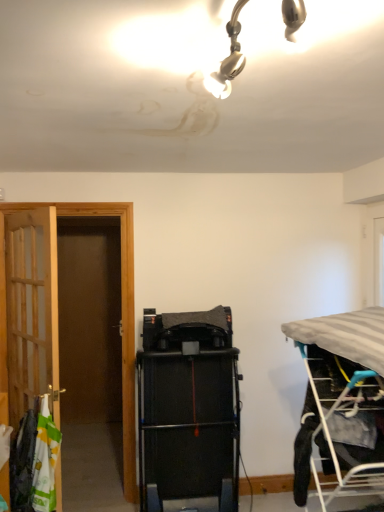
What do you see at coordinates (341, 404) in the screenshot? I see `gray fabric bed at right` at bounding box center [341, 404].

Identify the location of wooden door at left. (31, 310).

This screenshot has height=512, width=384. I want to click on white fabric laundry at left, so click(x=34, y=462).

Is black rubber treadmill at center next to white fabric laundry at left?

black rubber treadmill at center and white fabric laundry at left are clearly separated.

Is black rubber treadmill at center taller or shorter than white fabric laundry at left?

Clearly, black rubber treadmill at center is taller compared to white fabric laundry at left.

Considering the points (225, 337) and (22, 443), which point is in front, point (225, 337) or point (22, 443)?

The point (22, 443) is more forward.

Which of these two, black rubber treadmill at center or white fabric laundry at left, is smaller?

white fabric laundry at left is smaller.

Is there a large distance between white fabric laundry at left and wooden door at left?

No.

From a real-world perspective, does white fabric laundry at left sit lower than wooden door at left?

Yes, from a real-world perspective, white fabric laundry at left is beneath wooden door at left.

Considering the relative sizes of white fabric laundry at left and wooden door at left in the image provided, is white fabric laundry at left shorter than wooden door at left?

Indeed, white fabric laundry at left has a lesser height compared to wooden door at left.

What's the angular difference between black rubber treadmill at center and gray fabric bed at right's facing directions?

The facing directions of black rubber treadmill at center and gray fabric bed at right are 88.3 degrees apart.

Based on the photo, does black rubber treadmill at center come behind gray fabric bed at right?

Yes, black rubber treadmill at center is further from the camera.

I want to click on bed above the black rubber treadmill at center (from the image's perspective), so click(341, 404).

Based on their sizes in the image, would you say black rubber treadmill at center is bigger or smaller than gray fabric bed at right?

Clearly, black rubber treadmill at center is larger in size than gray fabric bed at right.

Who is shorter, gray fabric bed at right or white fabric laundry at left?

With less height is white fabric laundry at left.

From the picture: Can we say gray fabric bed at right lies outside white fabric laundry at left?

Indeed, gray fabric bed at right is completely outside white fabric laundry at left.

Does gray fabric bed at right appear on the right side of white fabric laundry at left?

Yes.

Considering the sizes of gray fabric bed at right and white fabric laundry at left in the image, is gray fabric bed at right bigger or smaller than white fabric laundry at left?

Clearly, gray fabric bed at right is larger in size than white fabric laundry at left.

Consider the image. From a real-world perspective, does wooden door at left sit lower than white fabric laundry at left?

No.

Is wooden door at left not inside white fabric laundry at left?

Yes, wooden door at left is located beyond the bounds of white fabric laundry at left.

Consider the image. Considering the sizes of objects wooden door at left and white fabric laundry at left in the image provided, who is taller, wooden door at left or white fabric laundry at left?

With more height is wooden door at left.

The width and height of the screenshot is (384, 512). What are the coordinates of `laundry on the right of the wooden door at left` in the screenshot? It's located at (34, 462).

Can you tell me how much gray fabric bed at right and wooden door at left differ in facing direction?

gray fabric bed at right and wooden door at left are facing 145 degrees away from each other.

Visually, is gray fabric bed at right positioned to the left or to the right of wooden door at left?

Clearly, gray fabric bed at right is on the right of wooden door at left in the image.

Are gray fabric bed at right and wooden door at left beside each other?

gray fabric bed at right is not next to wooden door at left, and they're not touching.

Based on the photo, based on their positions, is wooden door at left located to the left or right of black rubber treadmill at center?

Clearly, wooden door at left is on the left of black rubber treadmill at center in the image.

Who is taller, wooden door at left or black rubber treadmill at center?

Standing taller between the two is wooden door at left.

Is there a large distance between wooden door at left and black rubber treadmill at center?

No, wooden door at left is in close proximity to black rubber treadmill at center.

From the picture: How far apart are wooden door at left and black rubber treadmill at center?

31.05 inches.

Image resolution: width=384 pixels, height=512 pixels. What are the coordinates of `laundry below the black rubber treadmill at center (from a real-world perspective)` in the screenshot? It's located at (34, 462).

Find the location of a particular element. The height and width of the screenshot is (512, 384). door behind the white fabric laundry at left is located at coordinates (31, 310).

Looking at the image, which one is located further to black rubber treadmill at center, gray fabric bed at right or white fabric laundry at left?

gray fabric bed at right is positioned further to the anchor black rubber treadmill at center.

Which object lies further to the anchor point wooden door at left, white fabric laundry at left or black rubber treadmill at center?

Based on the image, black rubber treadmill at center appears to be further to wooden door at left.

Looking at this image, from the image, which object appears to be nearer to gray fabric bed at right, white fabric laundry at left or wooden door at left?

Among the two, white fabric laundry at left is located nearer to gray fabric bed at right.

From the image, which object appears to be farther from white fabric laundry at left, wooden door at left or black rubber treadmill at center?

black rubber treadmill at center is further to white fabric laundry at left.

From the image, which object appears to be nearer to white fabric laundry at left, black rubber treadmill at center or wooden door at left?

wooden door at left is closer to white fabric laundry at left.

Considering their positions, is black rubber treadmill at center positioned closer to wooden door at left than gray fabric bed at right?

Among the two, black rubber treadmill at center is located nearer to wooden door at left.

Which object lies nearer to the anchor point white fabric laundry at left, gray fabric bed at right or wooden door at left?

wooden door at left.

Looking at the image, which one is located further to wooden door at left, black rubber treadmill at center or white fabric laundry at left?

black rubber treadmill at center is positioned further to the anchor wooden door at left.

The image size is (384, 512). Find the location of `laundry between wooden door at left and black rubber treadmill at center from left to right`. laundry between wooden door at left and black rubber treadmill at center from left to right is located at coordinates (34, 462).

Find the location of a particular element. The width and height of the screenshot is (384, 512). equipment located between wooden door at left and gray fabric bed at right in the left-right direction is located at coordinates (188, 410).

Where is `equipment situated between white fabric laundry at left and gray fabric bed at right from left to right`? Image resolution: width=384 pixels, height=512 pixels. equipment situated between white fabric laundry at left and gray fabric bed at right from left to right is located at coordinates (188, 410).

At what (x,y) coordinates should I click in order to perform the action: click on laundry located between wooden door at left and gray fabric bed at right in the left-right direction. Please return your answer as a coordinate pair (x, y). This screenshot has width=384, height=512. Looking at the image, I should click on (34, 462).